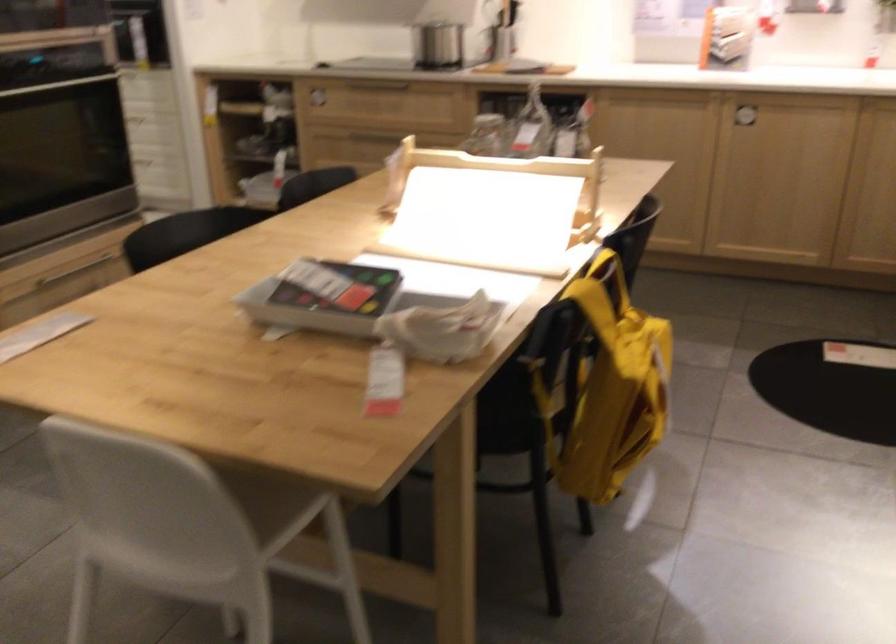
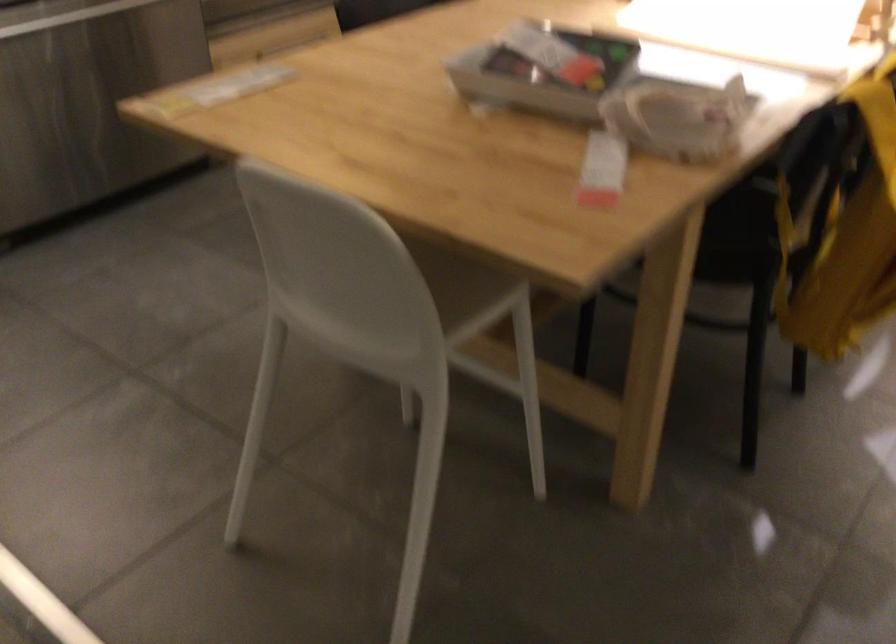
Question: In a continuous first-person perspective shot, in which direction is the camera moving?

Choices:
 (A) Left
 (B) Right
 (C) Forward
 (D) Backward

Answer: (C)